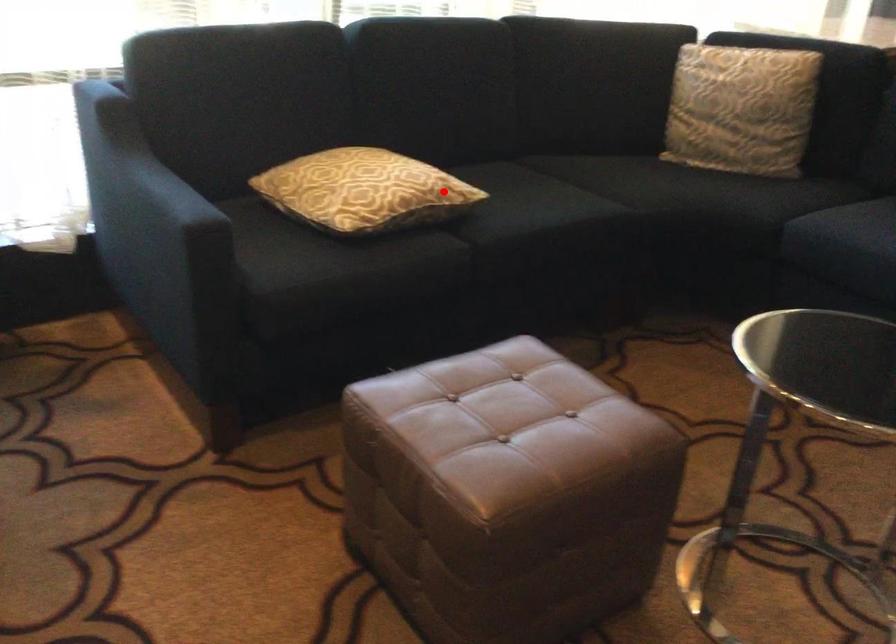
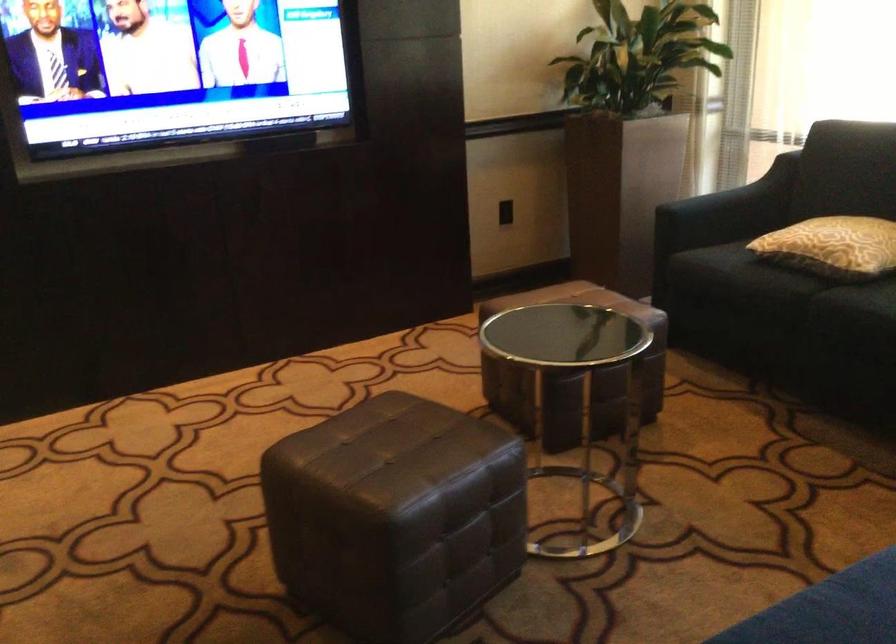
Question: I am providing you with two images of the same scene from different viewpoints. In image1, a red point is highlighted. Considering the same 3D point in image2, which of the following is correct?

Choices:
 (A) It is closer
 (B) It is farther

Answer: (B)